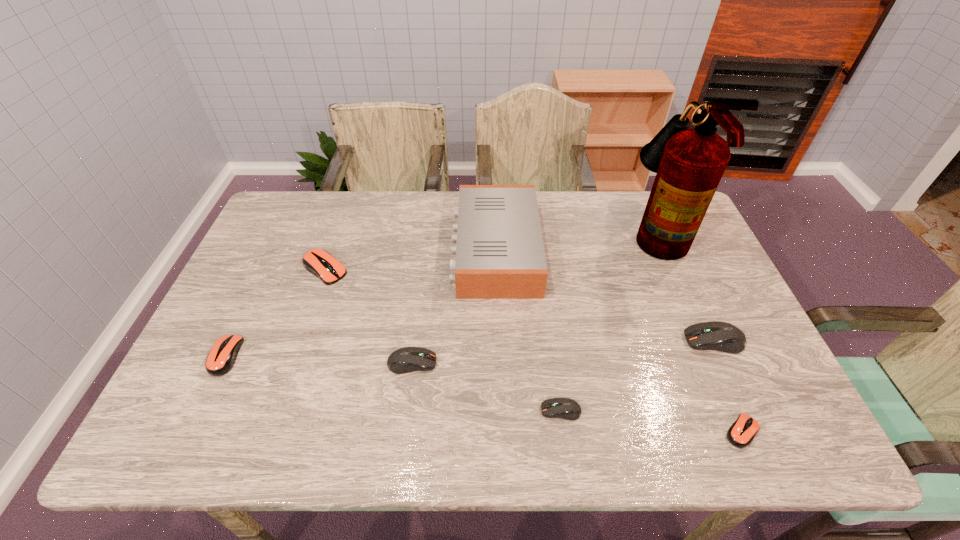
Locate an element on the screen. fire extinguisher is located at coordinates (689, 163).

Where is `red fire extinguisher`? red fire extinguisher is located at coordinates (689, 163).

You are a GUI agent. You are given a task and a screenshot of the screen. Output one action in this format:
    pyautogui.click(x=<x>, y=<y>)
    Task: Click on the second tallest object
    The image size is (960, 540).
    Given the screenshot: What is the action you would take?
    pyautogui.click(x=500, y=254)

This screenshot has width=960, height=540. Identify the location of the sixth shortest object. (720, 336).

You are a GUI agent. You are given a task and a screenshot of the screen. Output one action in this format:
    pyautogui.click(x=<x>, y=<y>)
    Task: Click on the tallest computer mouse
    This screenshot has height=540, width=960.
    Given the screenshot: What is the action you would take?
    pyautogui.click(x=720, y=336)

In order to click on the second computer mouse from left to right in this screenshot , I will do `click(319, 262)`.

Where is `the second object from left to right`? the second object from left to right is located at coordinates (319, 262).

Locate an element on the screen. The height and width of the screenshot is (540, 960). the second biggest dark computer equipment is located at coordinates (406, 359).

This screenshot has width=960, height=540. I want to click on the third object from left to right, so click(x=406, y=359).

Locate an element on the screen. This screenshot has height=540, width=960. the second biggest orange computer mouse is located at coordinates (221, 358).